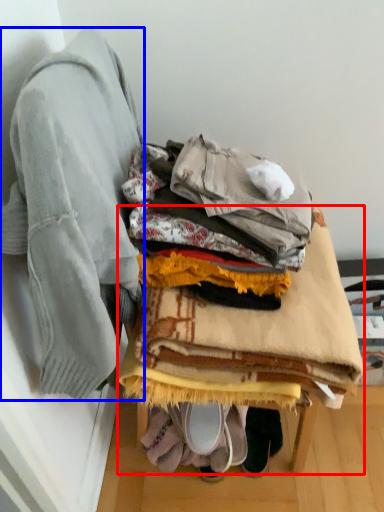
Question: Which object appears closest to the camera in this image, furniture (highlighted by a red box) or jacket (highlighted by a blue box)?

Choices:
 (A) furniture
 (B) jacket

Answer: (B)